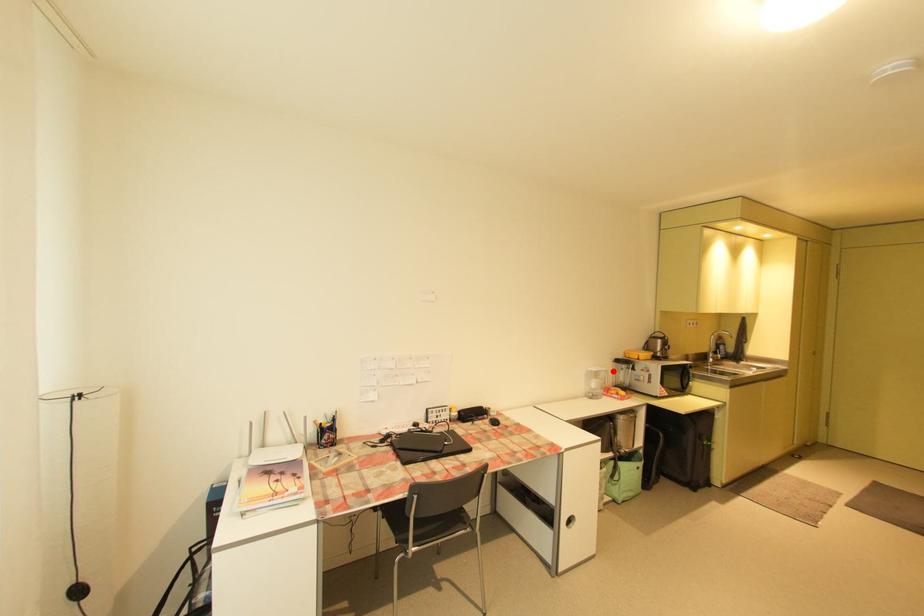
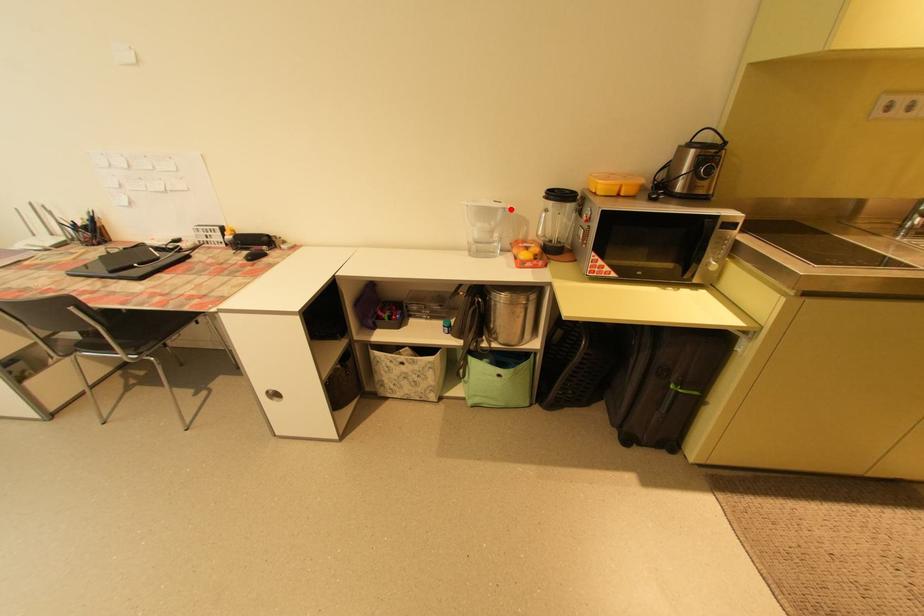
I am providing you with two images of the same scene from different viewpoints. A red point is marked on the first image and another point is marked on the second image. Does the point marked in image1 correspond to the same location as the one in image2?

Yes